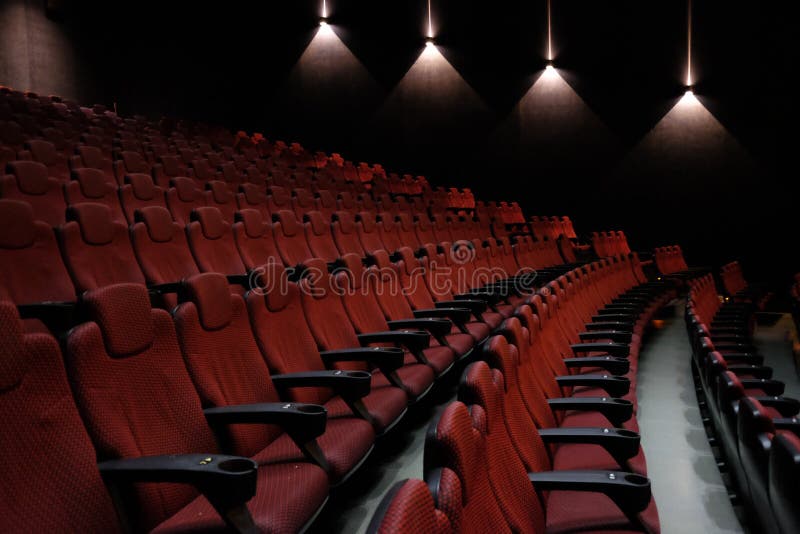
The width and height of the screenshot is (800, 534). I want to click on lights, so click(x=686, y=75), click(x=544, y=54), click(x=430, y=29), click(x=322, y=11).